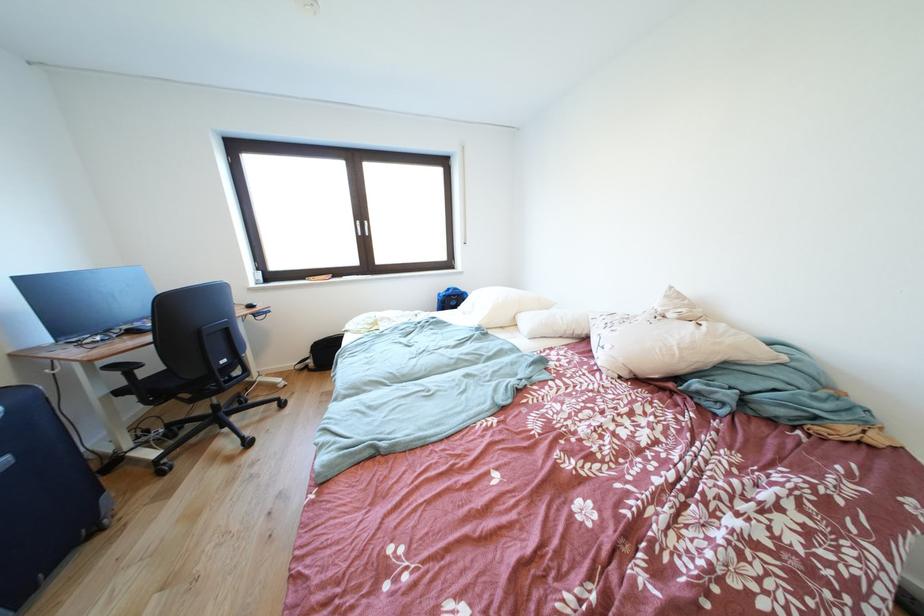
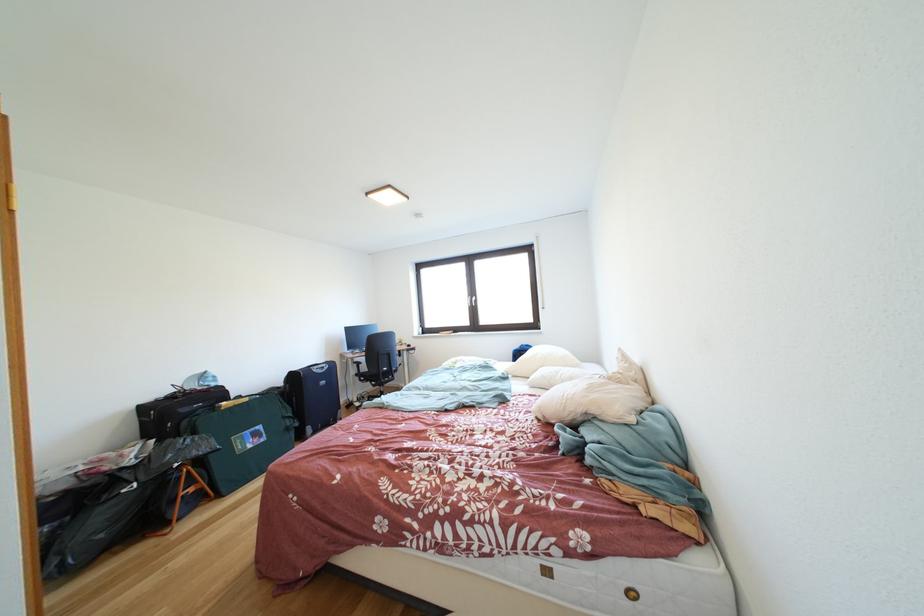
Find the pixel in the second image that matches point 199,406 in the first image.

(383, 391)